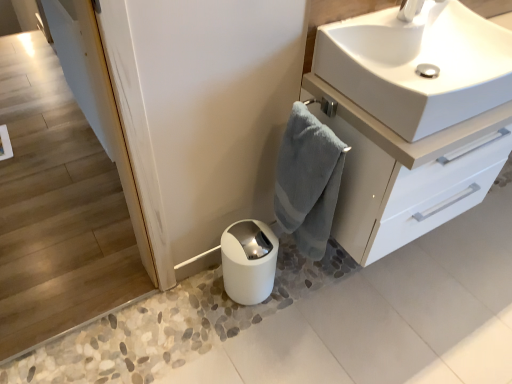
Find the location of a particular element. vacant space to the left of white glossy toilet paper at lower center is located at coordinates (199, 297).